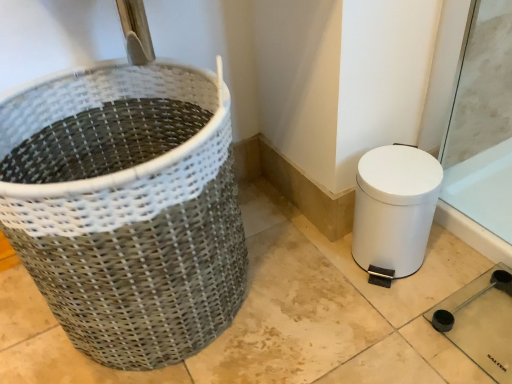
Image resolution: width=512 pixels, height=384 pixels. Identify the location of vacant region to the left of white matte toilet bowl at lower right. (314, 275).